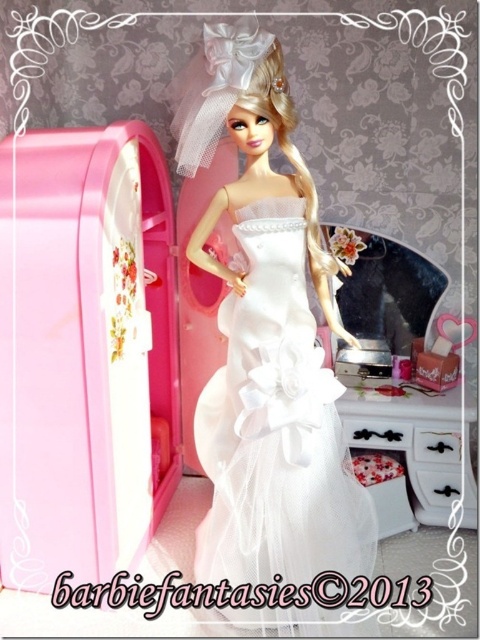
Question: Which of the following is the farthest from the observer?

Choices:
 (A) white wood dresser at lower right
 (B) matte white dress at center

Answer: (A)

Question: Which object is farther from the camera taking this photo?

Choices:
 (A) matte white dress at center
 (B) white wood dresser at lower right

Answer: (B)

Question: Does matte white dress at center come in front of white wood dresser at lower right?

Choices:
 (A) yes
 (B) no

Answer: (A)

Question: Is matte white dress at center to the left of white wood dresser at lower right from the viewer's perspective?

Choices:
 (A) yes
 (B) no

Answer: (A)

Question: Does matte white dress at center have a larger size compared to white wood dresser at lower right?

Choices:
 (A) no
 (B) yes

Answer: (B)